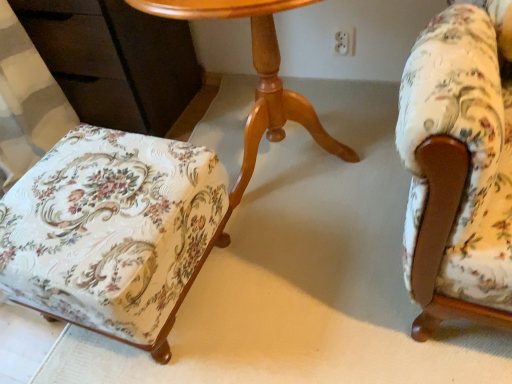
Question: Considering the positions of light brown wood table at center and floral fabric ottoman at lower left, the second chair in the right-to-left sequence, in the image, is light brown wood table at center taller or shorter than floral fabric ottoman at lower left, the second chair in the right-to-left sequence,?

Choices:
 (A) short
 (B) tall

Answer: (B)

Question: Based on their positions, is light brown wood table at center located to the left or right of floral fabric ottoman at lower left, which is the 1th chair from left to right?

Choices:
 (A) left
 (B) right

Answer: (B)

Question: Based on their relative distances, which object is farther from the floral fabric armchair at right, acting as the 2th chair starting from the left?

Choices:
 (A) floral fabric ottoman at lower left, the second chair in the right-to-left sequence
 (B) light brown wood table at center

Answer: (A)

Question: Based on their relative distances, which object is farther from the light brown wood table at center?

Choices:
 (A) floral fabric ottoman at lower left, the second chair in the right-to-left sequence
 (B) floral fabric armchair at right, arranged as the first chair when viewed from the right

Answer: (B)